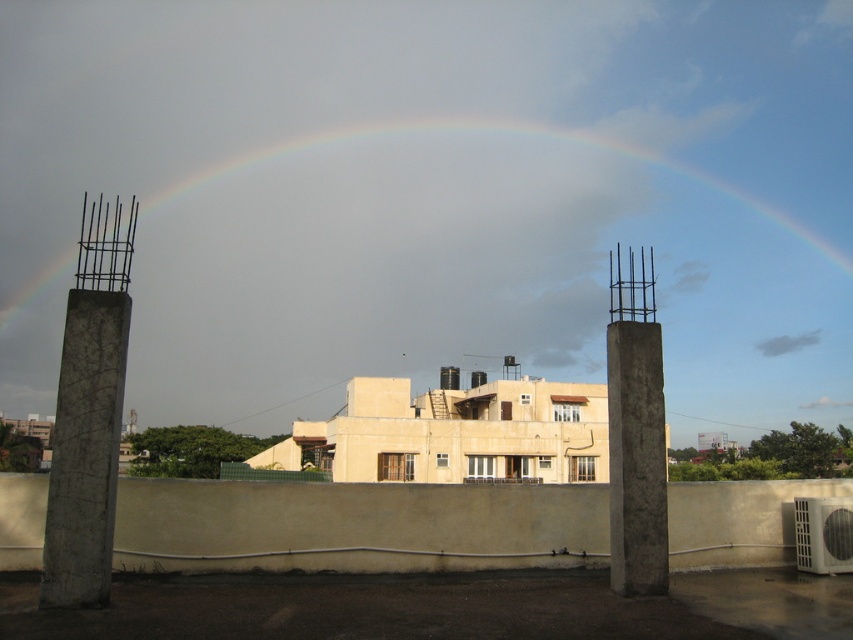
Is rainbow at upper center to the left of concrete rough at left from the viewer's perspective?

Yes, rainbow at upper center is to the left of concrete rough at left.

Which is behind, point (86, 124) or point (86, 371)?

The point (86, 124) is more distant.

This screenshot has width=853, height=640. Identify the location of rainbow at upper center. (428, 209).

Does concrete rough at left lie in front of gray concrete pillar at right?

That is True.

Which of these two, concrete rough at left or gray concrete pillar at right, stands shorter?

With less height is concrete rough at left.

Is point (83, 509) positioned in front of point (642, 516)?

Yes, point (83, 509) is in front of point (642, 516).

Find the location of a particular element. concrete rough at left is located at coordinates (85, 451).

Who is positioned more to the right, rainbow at upper center or gray concrete pillar at right?

gray concrete pillar at right

Who is higher up, rainbow at upper center or gray concrete pillar at right?

rainbow at upper center is higher up.

Does point (637, 182) come farther from viewer compared to point (653, 348)?

Yes, point (637, 182) is behind point (653, 348).

Image resolution: width=853 pixels, height=640 pixels. I want to click on rainbow at upper center, so click(428, 209).